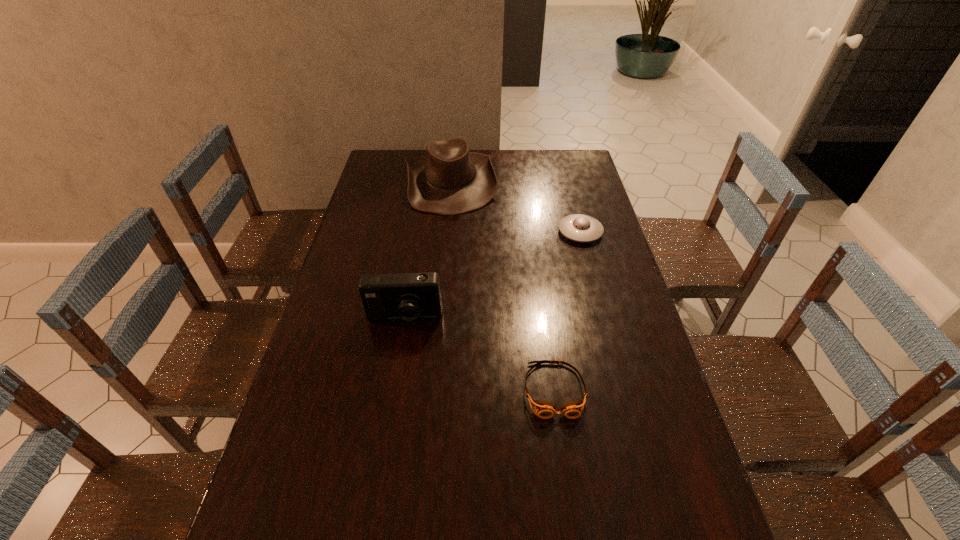
Where is `object located at the far edge`? object located at the far edge is located at coordinates (449, 180).

The height and width of the screenshot is (540, 960). I want to click on cowboy hat that is at the left edge, so click(449, 180).

At what (x,y) coordinates should I click in order to perform the action: click on camera positioned at the left edge. Please return your answer as a coordinate pair (x, y). This screenshot has width=960, height=540. Looking at the image, I should click on (404, 296).

Find the location of a particular element. The width and height of the screenshot is (960, 540). object that is at the right edge is located at coordinates (581, 228).

The height and width of the screenshot is (540, 960). What are the coordinates of `object that is at the far left corner` in the screenshot? It's located at pyautogui.click(x=449, y=180).

In the image, there is a desktop. Find the location of `free space at the far edge`. free space at the far edge is located at coordinates (529, 149).

This screenshot has width=960, height=540. I want to click on vacant region at the left edge of the desktop, so click(345, 265).

In the image, there is a desktop. Where is `free space at the right edge`? This screenshot has height=540, width=960. free space at the right edge is located at coordinates (612, 296).

You are a GUI agent. You are given a task and a screenshot of the screen. Output one action in this format:
    pyautogui.click(x=<x>, y=<y>)
    Task: Click on the vacant point at the far left corner
    The image size is (960, 540).
    Given the screenshot: What is the action you would take?
    pyautogui.click(x=399, y=163)

The width and height of the screenshot is (960, 540). What are the coordinates of `free space that is in between the third farthest object and the nearest object` in the screenshot? It's located at (479, 354).